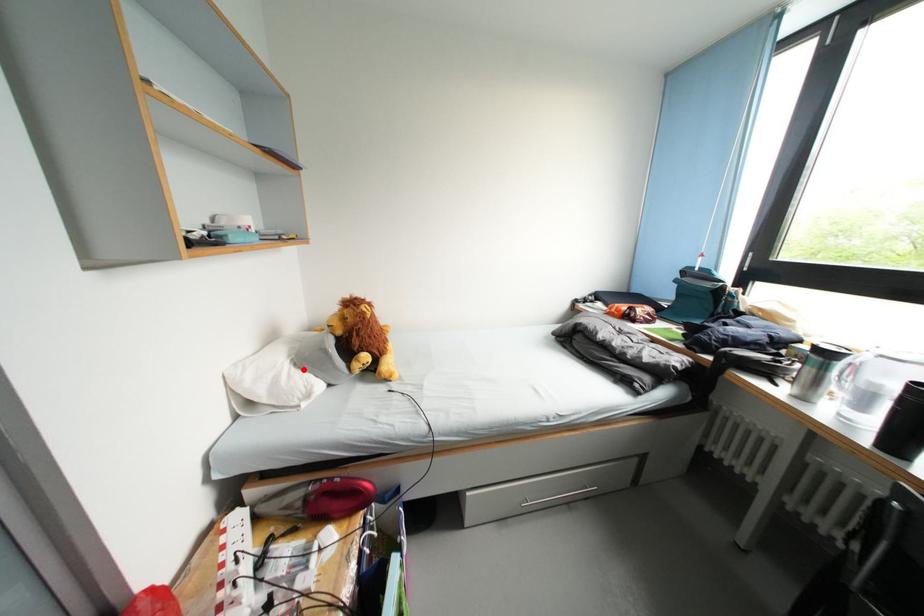
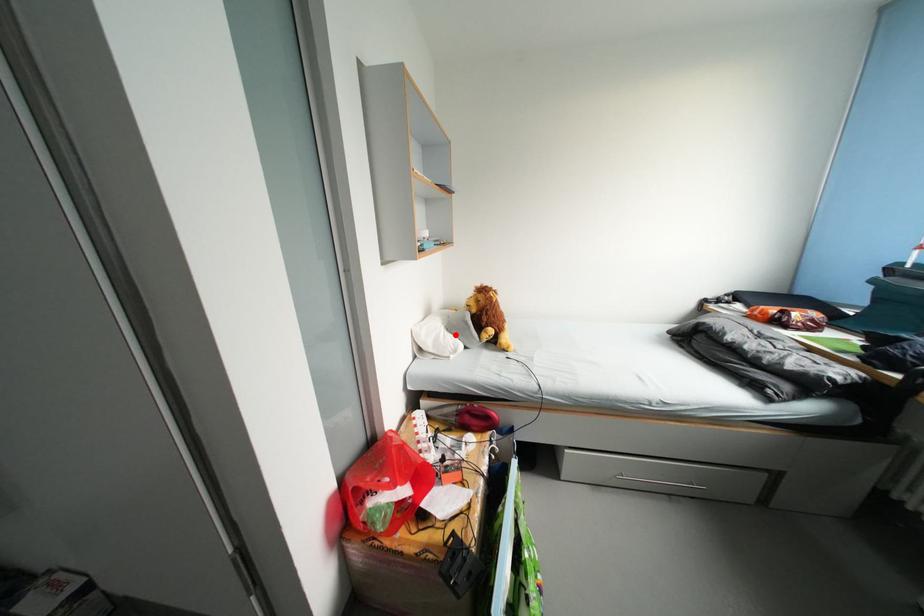
I am providing you with two images of the same scene from different viewpoints. A red point is marked on the first image and another point is marked on the second image. Does the point marked in image1 correspond to the same location as the one in image2?

Yes